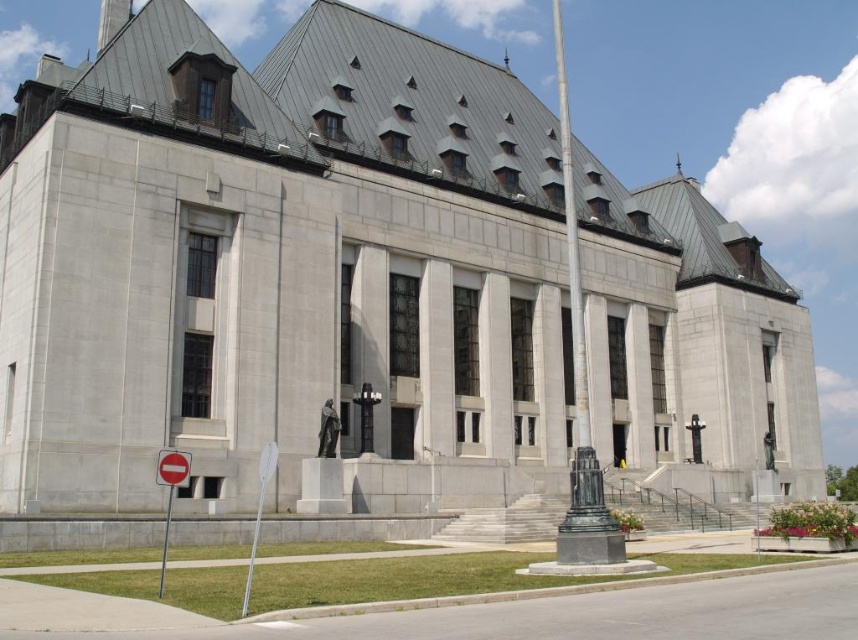
Question: Can you confirm if white plastic sign at lower left is positioned above red plastic sign at lower left?

Choices:
 (A) no
 (B) yes

Answer: (A)

Question: Which object is positioned farthest from the metallic reflective sign at lower left?

Choices:
 (A) red plastic sign at lower left
 (B) bronze flagpole at center
 (C) white plastic sign at lower left

Answer: (B)

Question: Does bronze flagpole at center have a larger size compared to white plastic sign at lower left?

Choices:
 (A) no
 (B) yes

Answer: (B)

Question: Which of the following is the closest to the observer?

Choices:
 (A) 174,465
 (B) 158,458
 (C) 260,481

Answer: (A)

Question: Which object is closer to the camera taking this photo?

Choices:
 (A) red plastic sign at lower left
 (B) white plastic sign at lower left
 (C) bronze flagpole at center
 (D) metallic reflective sign at lower left

Answer: (B)

Question: Is bronze flagpole at center to the right of metallic reflective sign at lower left from the viewer's perspective?

Choices:
 (A) yes
 (B) no

Answer: (A)